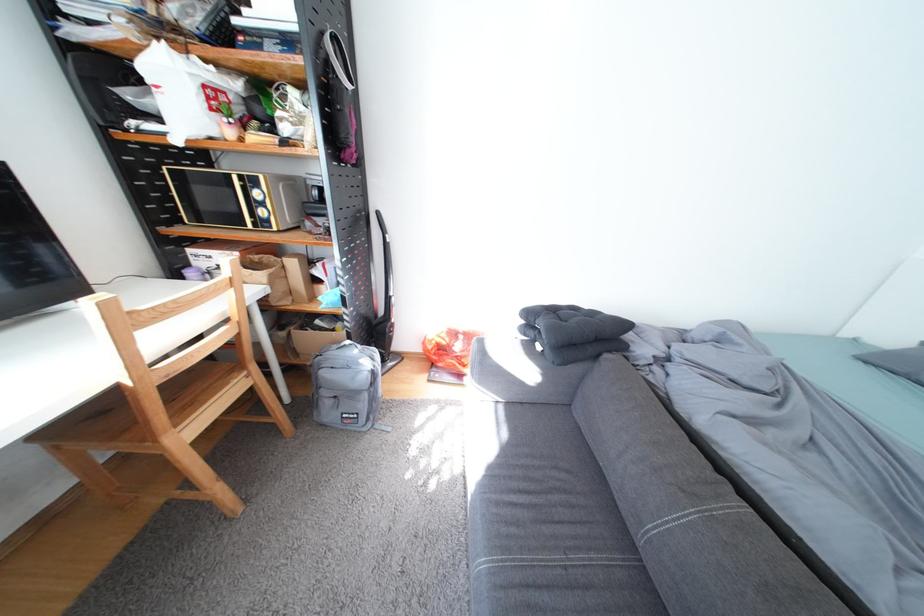
What do you see at coordinates (240, 199) in the screenshot?
I see `a microwave door handle` at bounding box center [240, 199].